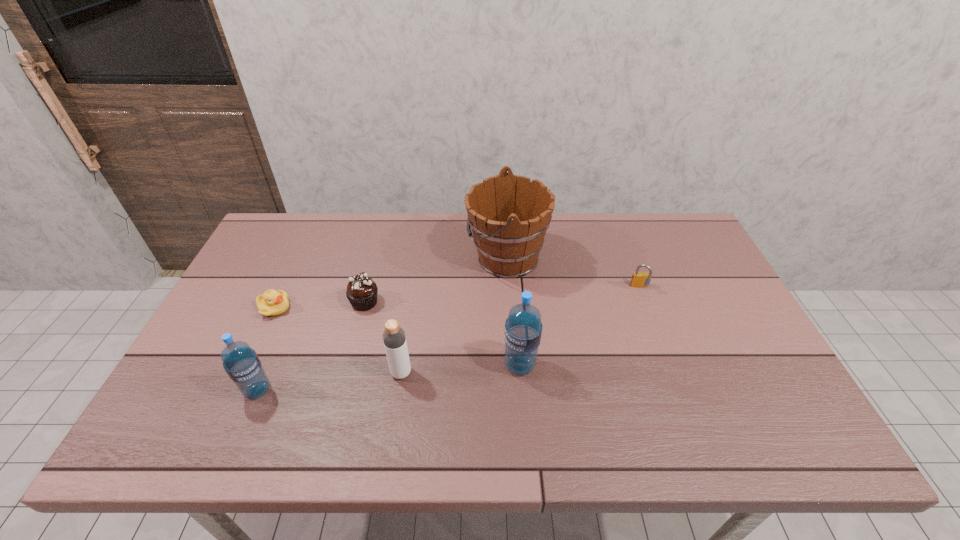
The width and height of the screenshot is (960, 540). In order to click on object at the near left corner in this screenshot , I will do `click(241, 363)`.

In the image, there is a desktop. Identify the location of vacant region at the far edge. (466, 248).

Locate an element on the screen. The image size is (960, 540). free region at the near edge of the desktop is located at coordinates pyautogui.click(x=492, y=391).

Find the location of a particular element. This screenshot has height=540, width=960. vacant space at the right edge is located at coordinates pyautogui.click(x=688, y=296).

Image resolution: width=960 pixels, height=540 pixels. In the image, there is a desktop. Identify the location of free space at the far right corner. (694, 248).

Locate an element on the screen. The width and height of the screenshot is (960, 540). vacant area that lies between the shortest object and the wine bucket is located at coordinates (391, 283).

Where is `free point between the duckling and the wine bucket`? This screenshot has width=960, height=540. free point between the duckling and the wine bucket is located at coordinates (391, 283).

You are a GUI agent. You are given a task and a screenshot of the screen. Output one action in this format:
    pyautogui.click(x=<x>, y=<y>)
    Task: Click on the free space between the third object from left to right and the rightmost object
    
    Given the screenshot: What is the action you would take?
    pyautogui.click(x=502, y=295)

Identify the location of empty space between the shorter water bottle and the duckling. (266, 349).

At what (x,y) coordinates should I click in order to perform the action: click on vacant point located between the wine bucket and the left water bottle. Please return your answer as a coordinate pair (x, y). The image size is (960, 540). Looking at the image, I should click on (382, 324).